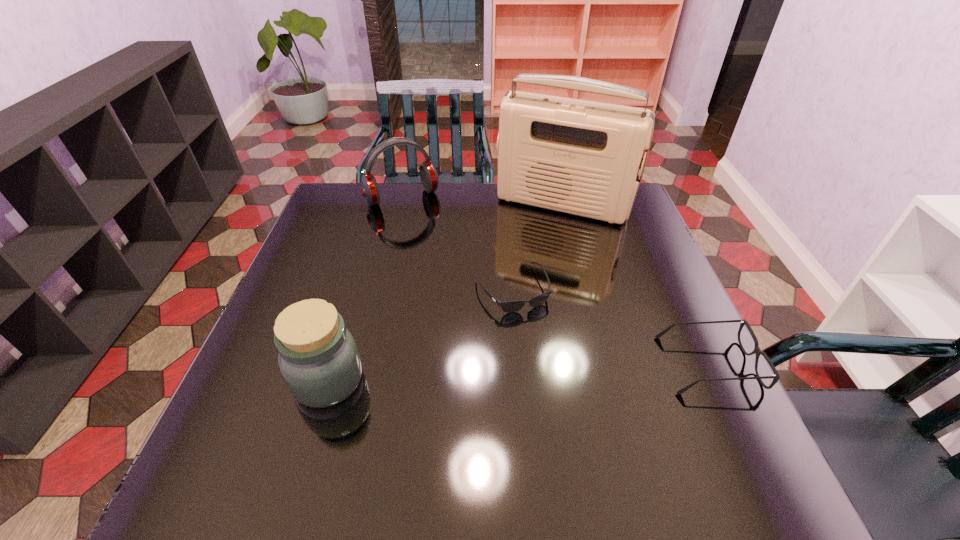
At what (x,y) coordinates should I click in order to perform the action: click on vacant space on the desktop that is between the jar and the second shortest object and is positioned on the front-facing side of the radio receiver. Please return your answer as a coordinate pair (x, y). This screenshot has height=540, width=960. Looking at the image, I should click on (483, 374).

Find the location of `vacant space on the desktop that is between the jar and the spectacles and is positioned on the ear cups of the earphone`. vacant space on the desktop that is between the jar and the spectacles and is positioned on the ear cups of the earphone is located at coordinates (511, 373).

Where is `free space on the desktop that is between the jar and the spectacles and is positioned on the front-facing side of the third nearest object`? The image size is (960, 540). free space on the desktop that is between the jar and the spectacles and is positioned on the front-facing side of the third nearest object is located at coordinates (557, 371).